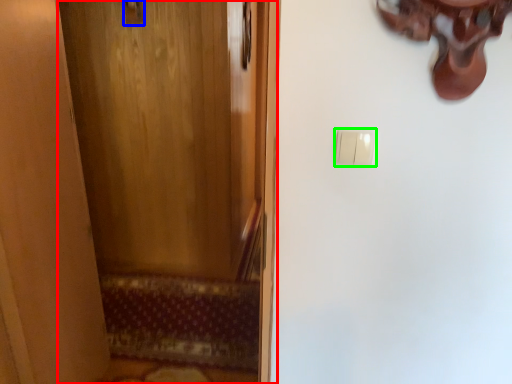
Question: Considering the real-world distances, which object is farthest from door (highlighted by a red box)? door handle (highlighted by a blue box) or light switch (highlighted by a green box)?

Choices:
 (A) door handle
 (B) light switch

Answer: (B)